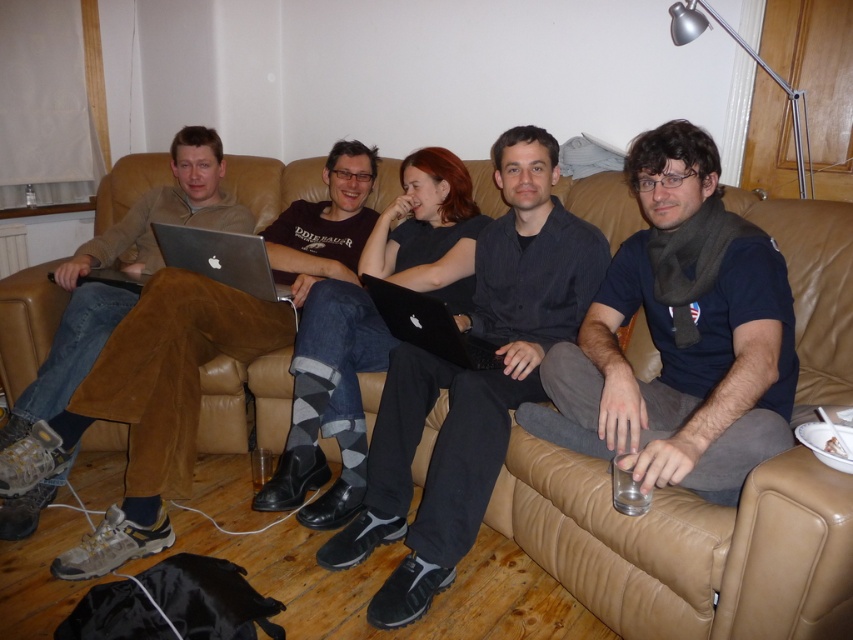
Is dark gray shirt at center thinner than matte black laptop at left?

In fact, dark gray shirt at center might be wider than matte black laptop at left.

Can you confirm if dark gray shirt at center is positioned below matte black laptop at left?

Yes.

Identify the location of dark gray shirt at center. (473, 381).

Identify the location of dark gray shirt at center. The width and height of the screenshot is (853, 640). (473, 381).

Can you confirm if matte brown pants at left is positioned to the left of matte silver laptop at center?

Yes, matte brown pants at left is to the left of matte silver laptop at center.

Is point (45, 378) closer to camera compared to point (238, 259)?

Yes, it is.

You are a GUI agent. You are given a task and a screenshot of the screen. Output one action in this format:
    pyautogui.click(x=<x>, y=<y>)
    Task: Click on the matte brown pants at left
    The width and height of the screenshot is (853, 640).
    Given the screenshot: What is the action you would take?
    tap(123, 269)

Between dark gray argyle socks at center and black matte laptop at center, which one is positioned higher?

Positioned higher is dark gray argyle socks at center.

Does dark gray argyle socks at center have a lesser height compared to black matte laptop at center?

In fact, dark gray argyle socks at center may be taller than black matte laptop at center.

Locate an element on the screen. This screenshot has width=853, height=640. dark gray argyle socks at center is located at coordinates (328, 403).